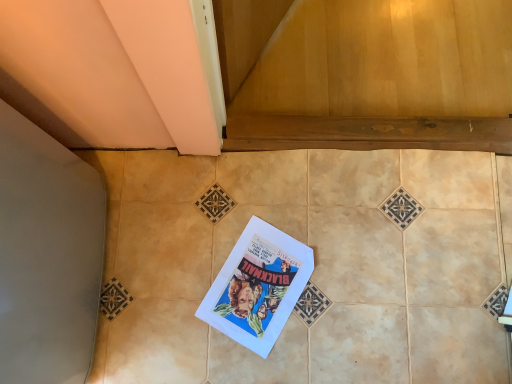
I want to click on free location to the right of white paper comic book at center, so click(x=346, y=296).